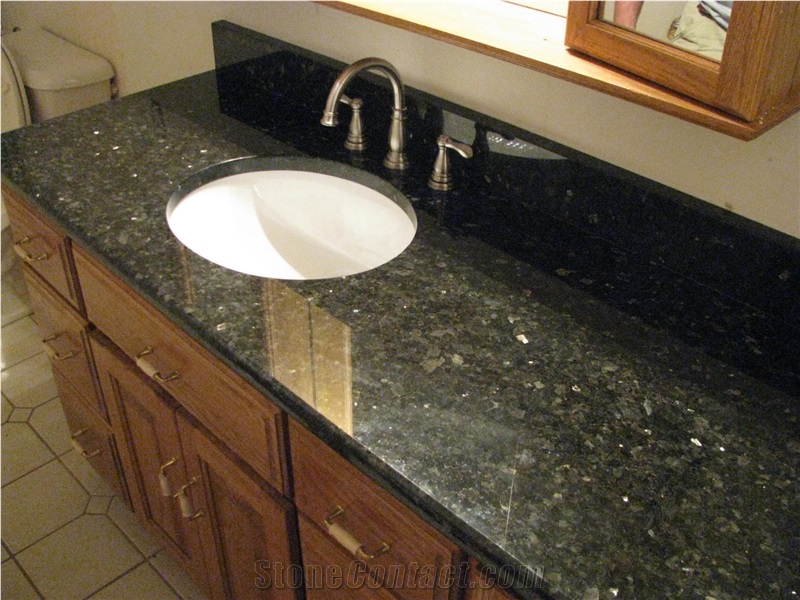
The width and height of the screenshot is (800, 600). Identify the location of handle. (349, 147).